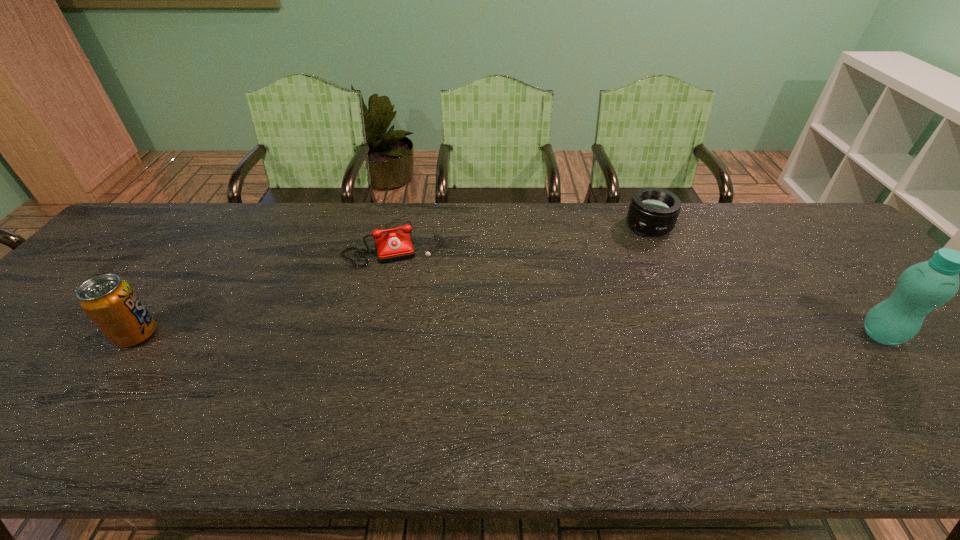
Where is `free area in between the telephoto lens and the shortest object`? free area in between the telephoto lens and the shortest object is located at coordinates click(x=522, y=234).

Where is `free space that is in between the soda can and the tallest object`? The height and width of the screenshot is (540, 960). free space that is in between the soda can and the tallest object is located at coordinates (509, 334).

Where is `vacant space in between the third object from left to right and the third shortest object`? This screenshot has height=540, width=960. vacant space in between the third object from left to right and the third shortest object is located at coordinates (393, 280).

Find the location of a particular element. The width and height of the screenshot is (960, 540). empty space between the leftmost object and the telephone is located at coordinates (266, 289).

Find the location of a particular element. Image resolution: width=960 pixels, height=540 pixels. free point between the second object from left to right and the soda can is located at coordinates (266, 289).

Where is `vacant point located between the telephoto lens and the tallest object`? vacant point located between the telephoto lens and the tallest object is located at coordinates pos(765,280).

What are the coordinates of `vacant area that lies between the soda can and the telephoto lens` in the screenshot? It's located at (393, 280).

Locate an element on the screen. vacant area between the telephoto lens and the telephone is located at coordinates (522, 234).

Identify the location of vacant region between the third object from right to left and the bottle. (638, 289).

You are a GUI agent. You are given a task and a screenshot of the screen. Output one action in this format:
    pyautogui.click(x=<x>, y=<y>)
    Task: Click on the free space between the telephone and the third object from left to right
    Image resolution: width=960 pixels, height=540 pixels.
    Given the screenshot: What is the action you would take?
    pyautogui.click(x=522, y=234)